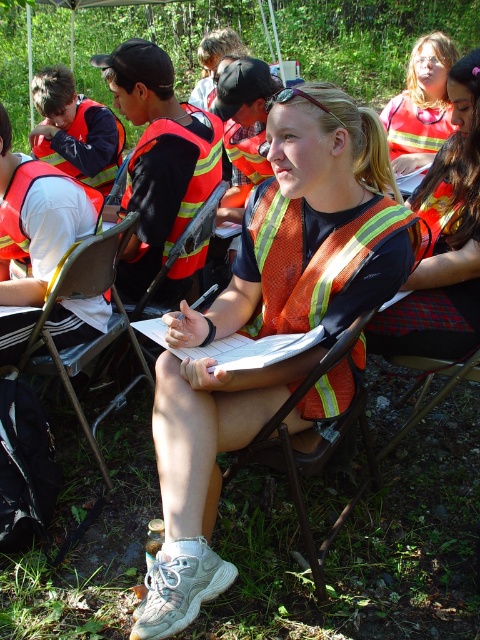
You are standing at the position of point (431,120) and want to walk to the position of point (122,312). Which direction should you move relative to your current position?

You should move forward because point (122,312) is in front of point (431,120).

You are standing at the origin point of the coordinate system. You see two points, point (408, 284) and point (391, 124). Which point is closer to you?

Point (408, 284) is in front of point (391, 124), so it is closer to you.

You are standing at the center of the image. You see a metallic silver chair at center. Where is the point located at coordinates (95, 339)?

The point located at coordinates (95, 339) is on the metallic silver chair at center.